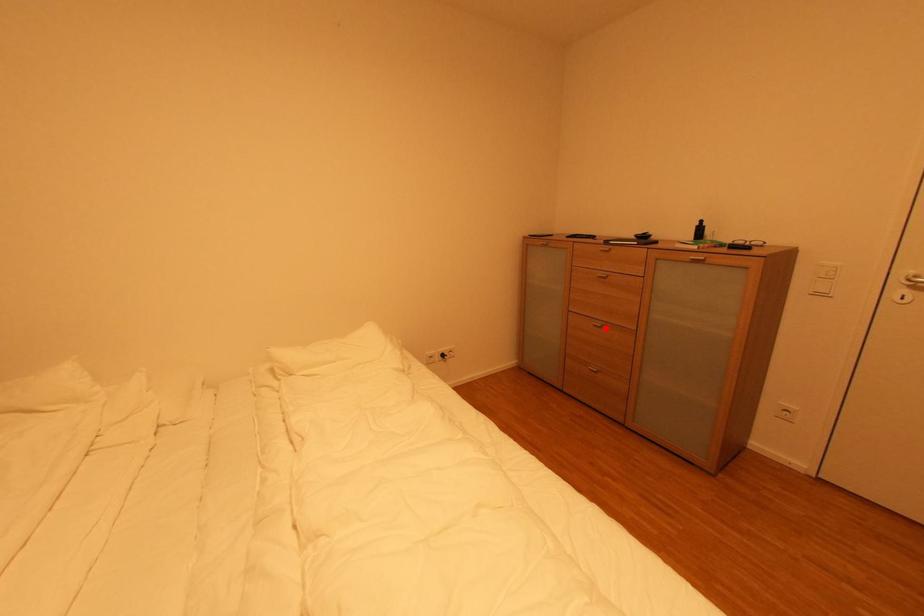
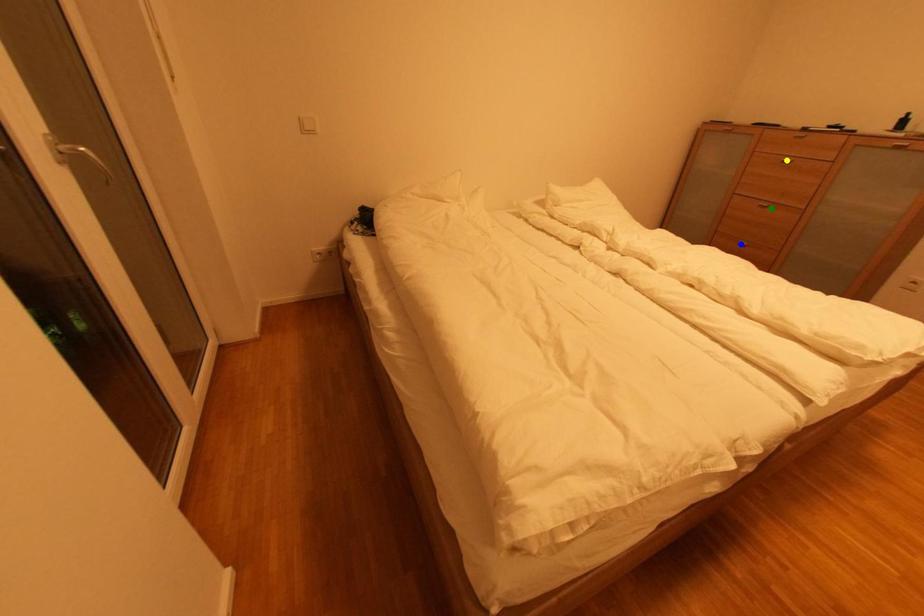
Question: I am providing you with two images of the same scene from different viewpoints. A red point is marked on the first image. You are given multiple points on the second image. Which spot in image 2 lines up with the point in image 1?

Choices:
 (A) blue point
 (B) yellow point
 (C) green point

Answer: (C)